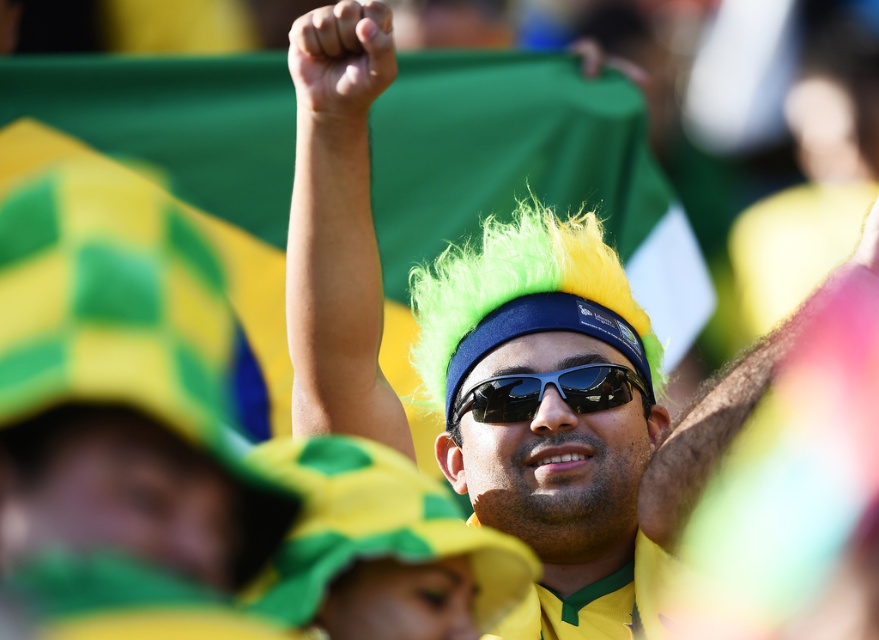
Between fluorescent green wig at center and black plastic goggles at center, which one is positioned higher?

black plastic goggles at center is higher up.

Who is more distant from viewer, (375, 314) or (492, 387)?

The point (492, 387) is behind.

Who is more forward, (488, 310) or (563, 392)?

Point (563, 392) is more forward.

The width and height of the screenshot is (879, 640). I want to click on fluorescent green wig at center, so click(570, 416).